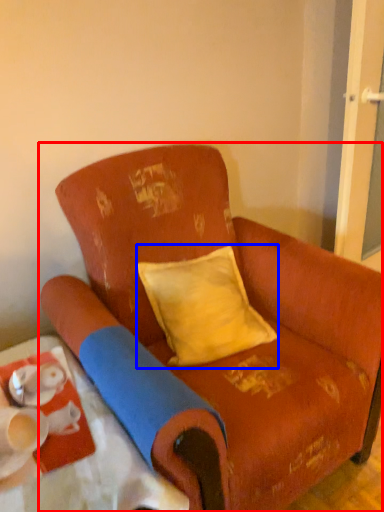
Question: Which point is closer to the camera, chair (highlighted by a red box) or pillow (highlighted by a blue box)?

Choices:
 (A) chair
 (B) pillow

Answer: (A)